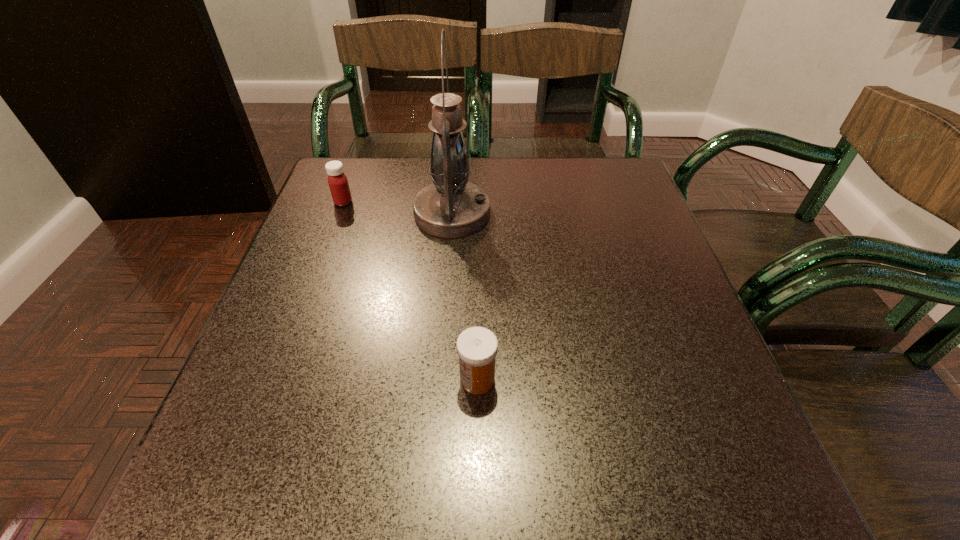
Identify the location of oil lamp. The width and height of the screenshot is (960, 540). (451, 207).

You are a GUI agent. You are given a task and a screenshot of the screen. Output one action in this format:
    pyautogui.click(x=<x>, y=<y>)
    Task: Click on the left medicine
    This screenshot has height=540, width=960.
    Given the screenshot: What is the action you would take?
    pyautogui.click(x=338, y=183)

The height and width of the screenshot is (540, 960). Find the location of `the farther medicine`. the farther medicine is located at coordinates (338, 183).

The height and width of the screenshot is (540, 960). What are the coordinates of `the right medicine` in the screenshot? It's located at (477, 347).

Image resolution: width=960 pixels, height=540 pixels. I want to click on the nearer medicine, so click(x=477, y=347).

Image resolution: width=960 pixels, height=540 pixels. In order to click on vacant space located on the left of the tallest object in this screenshot , I will do `click(364, 213)`.

Where is `vacant space located 0.130m on the front of the farther medicine`? vacant space located 0.130m on the front of the farther medicine is located at coordinates (328, 242).

The height and width of the screenshot is (540, 960). In order to click on free space located on the back of the nearest object in this screenshot , I will do `click(478, 307)`.

Identify the location of oil lamp positioned at the far edge. (451, 207).

I want to click on medicine that is positioned at the far edge, so click(338, 183).